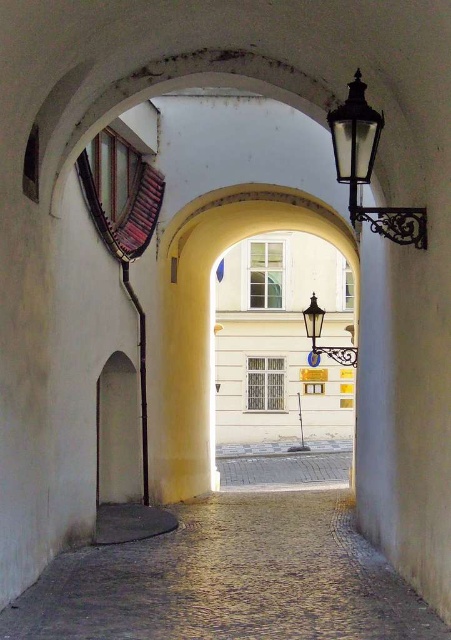
Based on the photo, you are an architect designing a new lighting system for the passageway. You need to ensure that the cobblestone at center does not block the light from the black glass lamp at upper right. Given their sizes, is this feasible?

The cobblestone at center occupies less space than the black glass lamp at upper right, so it is feasible to design the lighting system such that the smaller cobblestone at center does not obstruct the light from the larger black glass lamp at upper right.

You are standing in the passageway and want to place a small potted plant exactly where the cobblestone at center is located. According to the image, what are the coordinates of the spot where you should place the plant?

The coordinates for the cobblestone at center are at point (230, 580), so you should place the plant there.

You are standing in the passageway and want to touch both the cobblestone at center and the polished brass lantern at center. Which object should you reach for first to touch the one closer to you?

The cobblestone at center is closer to the viewer than the polished brass lantern at center, so you should reach for the cobblestone at center first.